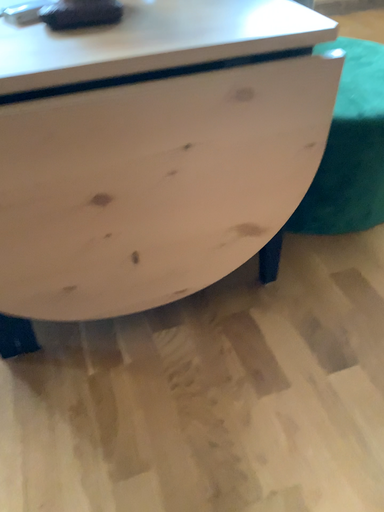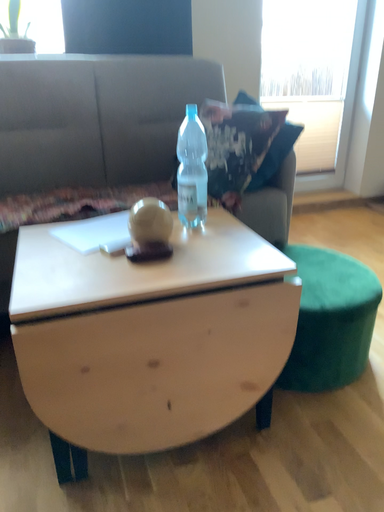
Question: Which way did the camera rotate in the video?

Choices:
 (A) rotated downward
 (B) rotated upward

Answer: (B)